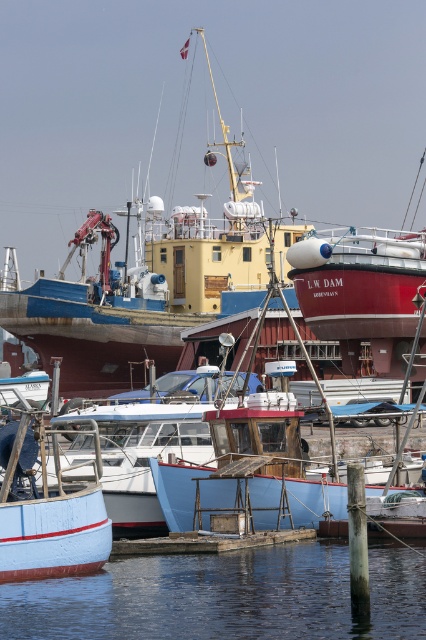
Question: Is yellow matte ship at center positioned before transparent water at lower center?

Choices:
 (A) yes
 (B) no

Answer: (B)

Question: Which point appears closest to the camera in this image?

Choices:
 (A) (143, 352)
 (B) (342, 560)

Answer: (B)

Question: Is yellow matte ship at center closer to the viewer compared to transparent water at lower center?

Choices:
 (A) no
 (B) yes

Answer: (A)

Question: Is yellow matte ship at center further to the viewer compared to transparent water at lower center?

Choices:
 (A) no
 (B) yes

Answer: (B)

Question: Which point is farther from the camera taking this photo?

Choices:
 (A) (235, 630)
 (B) (112, 280)

Answer: (B)

Question: Among these objects, which one is farthest from the camera?

Choices:
 (A) yellow matte ship at center
 (B) transparent water at lower center

Answer: (A)